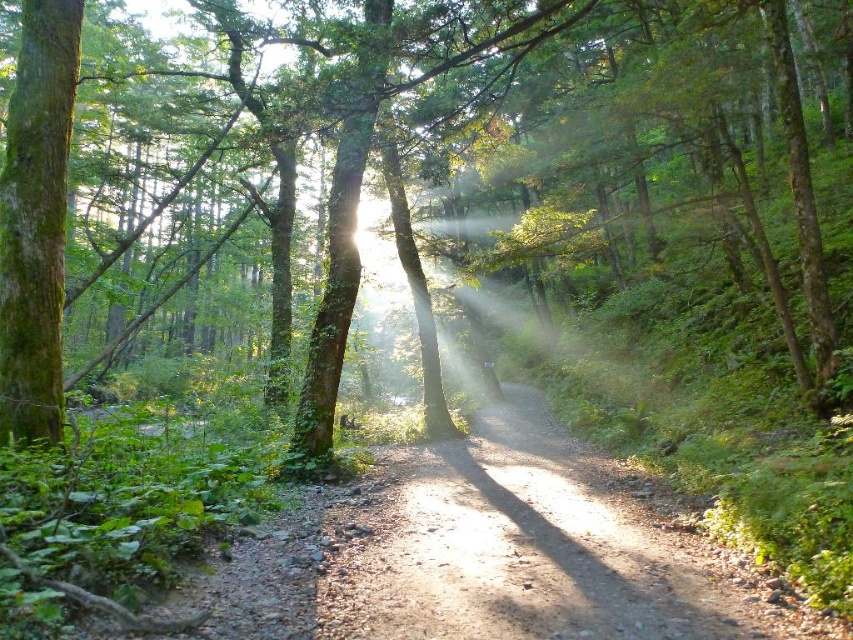
You are a hiker who wants to take a photo of the green mossy tree at center and the dirt path at center. Which object should you focus on first if you want to capture both in the same frame without moving your camera?

The green mossy tree at center has a greater height compared to the dirt path at center, so you should focus on the green mossy tree at center first to ensure both are in focus.

You are a hiker who wants to walk along the dirt path at center without getting too close to the green mossy tree at center. Based on the scene, can you tell me which one is wider between the two?

The green mossy tree at center is larger in size than the dirt path at center, so the green mossy tree at center is wider than the dirt path at center.

You are navigating through the forest and see two points marked on your map. One is labeled as point (339, 150) and the other as point (422, 468). Which point is closer to your current position if you are facing the direction where the sunlight is coming from?

Point (422, 468) is closer to your current position because it is in front of point (339, 150) when facing the direction of the sunlight.